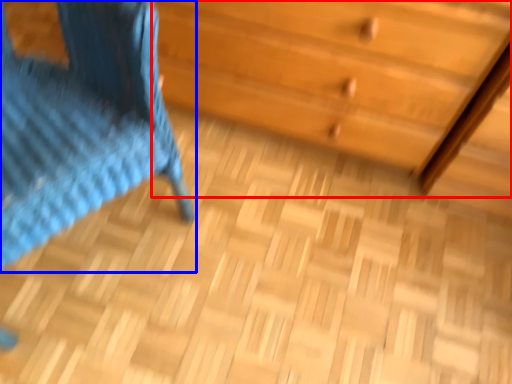
Question: Which point is closer to the camera, chest of drawers (highlighted by a red box) or furniture (highlighted by a blue box)?

Choices:
 (A) chest of drawers
 (B) furniture

Answer: (B)